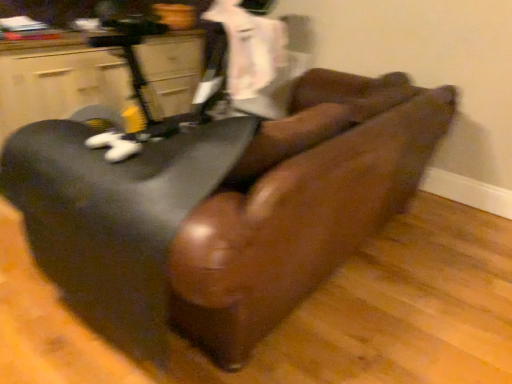
Question: Can you confirm if leather couch at center, which ranks as the 2th furniture in left-to-right order, is wider than matte black chair at left, which is counted as the 1th furniture, starting from the left?

Choices:
 (A) yes
 (B) no

Answer: (A)

Question: From the image's perspective, is leather couch at center, the first furniture positioned from the right, above matte black chair at left, which is counted as the 1th furniture, starting from the left?

Choices:
 (A) no
 (B) yes

Answer: (A)

Question: Considering the relative positions of leather couch at center, the first furniture positioned from the right, and matte black chair at left, which is counted as the 1th furniture, starting from the left, in the image provided, is leather couch at center, the first furniture positioned from the right, to the left of matte black chair at left, which is counted as the 1th furniture, starting from the left, from the viewer's perspective?

Choices:
 (A) no
 (B) yes

Answer: (A)

Question: From the image's perspective, is leather couch at center, the first furniture positioned from the right, located beneath matte black chair at left, the 2th furniture positioned from the right?

Choices:
 (A) yes
 (B) no

Answer: (A)

Question: Does leather couch at center, which ranks as the 2th furniture in left-to-right order, appear on the right side of matte black chair at left, the 2th furniture positioned from the right?

Choices:
 (A) yes
 (B) no

Answer: (A)

Question: Considering the relative sizes of leather couch at center, which ranks as the 2th furniture in left-to-right order, and matte black chair at left, the 2th furniture positioned from the right, in the image provided, is leather couch at center, which ranks as the 2th furniture in left-to-right order, thinner than matte black chair at left, the 2th furniture positioned from the right,?

Choices:
 (A) yes
 (B) no

Answer: (B)

Question: Can you confirm if matte black chair at left, which is counted as the 1th furniture, starting from the left, is positioned to the right of leather couch at center, the first furniture positioned from the right?

Choices:
 (A) yes
 (B) no

Answer: (B)

Question: Can you confirm if matte black chair at left, which is counted as the 1th furniture, starting from the left, is taller than leather couch at center, which ranks as the 2th furniture in left-to-right order?

Choices:
 (A) no
 (B) yes

Answer: (A)

Question: Is there a large distance between matte black chair at left, which is counted as the 1th furniture, starting from the left, and leather couch at center, which ranks as the 2th furniture in left-to-right order?

Choices:
 (A) no
 (B) yes

Answer: (B)

Question: Is matte black chair at left, which is counted as the 1th furniture, starting from the left, facing away from leather couch at center, the first furniture positioned from the right?

Choices:
 (A) no
 (B) yes

Answer: (A)

Question: Is matte black chair at left, the 2th furniture positioned from the right, completely or partially outside of leather couch at center, the first furniture positioned from the right?

Choices:
 (A) yes
 (B) no

Answer: (A)

Question: Considering the relative sizes of matte black chair at left, which is counted as the 1th furniture, starting from the left, and leather couch at center, which ranks as the 2th furniture in left-to-right order, in the image provided, is matte black chair at left, which is counted as the 1th furniture, starting from the left, smaller than leather couch at center, which ranks as the 2th furniture in left-to-right order,?

Choices:
 (A) no
 (B) yes

Answer: (B)

Question: In terms of size, does leather couch at center, which ranks as the 2th furniture in left-to-right order, appear bigger or smaller than matte black chair at left, the 2th furniture positioned from the right?

Choices:
 (A) big
 (B) small

Answer: (A)